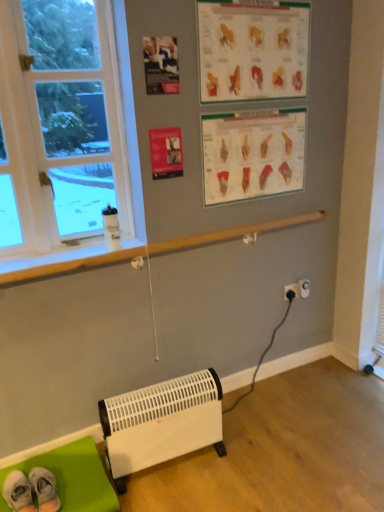
The width and height of the screenshot is (384, 512). What do you see at coordinates (18, 492) in the screenshot? I see `white fabric socks at lower left` at bounding box center [18, 492].

Where is `matte plastic poster at upper center, which is counted as the second writing, starting from the top`? Image resolution: width=384 pixels, height=512 pixels. matte plastic poster at upper center, which is counted as the second writing, starting from the top is located at coordinates (252, 154).

Describe the element at coordinates (252, 154) in the screenshot. I see `matte plastic poster at upper center, which is counted as the second writing, starting from the top` at that location.

Measure the distance between point (303, 295) and camera.

Point (303, 295) is 2.43 meters from camera.

Image resolution: width=384 pixels, height=512 pixels. What do you see at coordinates (304, 288) in the screenshot?
I see `white plastic electric outlet at lower right, the second electric outlet positioned from the left` at bounding box center [304, 288].

In order to click on green fabric mat at lower left in this screenshot , I will do `click(73, 477)`.

Does black plastic electric outlet at lower right, the second electric outlet viewed from the right, have a lesser width compared to green fabric mat at lower left?

Indeed, black plastic electric outlet at lower right, the second electric outlet viewed from the right, has a lesser width compared to green fabric mat at lower left.

This screenshot has width=384, height=512. Find the location of `furniture on the left of black plastic electric outlet at lower right, the second electric outlet viewed from the right`. furniture on the left of black plastic electric outlet at lower right, the second electric outlet viewed from the right is located at coordinates (73, 477).

Based on the photo, which of these two, black plastic electric outlet at lower right, placed as the first electric outlet when sorted from left to right, or green fabric mat at lower left, stands shorter?

black plastic electric outlet at lower right, placed as the first electric outlet when sorted from left to right.

Is white plastic window at left oriented towards matte plastic poster at upper center, marked as the second writing in a bottom-to-top arrangement?

No.

Is white plastic window at left smaller than matte plastic poster at upper center, marked as the second writing in a bottom-to-top arrangement?

Actually, white plastic window at left might be larger than matte plastic poster at upper center, marked as the second writing in a bottom-to-top arrangement.

Is point (72, 72) closer to viewer compared to point (226, 77)?

Yes, it is.

Are white plastic electric outlet at lower right, the second electric outlet positioned from the left, and white plastic window at left far apart?

white plastic electric outlet at lower right, the second electric outlet positioned from the left, is positioned a significant distance from white plastic window at left.

From a real-world perspective, is white plastic electric outlet at lower right, the second electric outlet positioned from the left, physically above white plastic window at left?

No, from a real-world perspective, white plastic electric outlet at lower right, the second electric outlet positioned from the left, is not on top of white plastic window at left.

Consider the image. From the image's perspective, between white plastic electric outlet at lower right, the second electric outlet positioned from the left, and white plastic window at left, who is located below?

white plastic electric outlet at lower right, the second electric outlet positioned from the left.

Looking at the image, does black plastic electric outlet at lower right, placed as the first electric outlet when sorted from left to right, seem bigger or smaller compared to matte plastic poster at upper center, which is counted as the 1th writing, starting from the bottom?

In the image, black plastic electric outlet at lower right, placed as the first electric outlet when sorted from left to right, appears to be smaller than matte plastic poster at upper center, which is counted as the 1th writing, starting from the bottom.

Is black plastic electric outlet at lower right, the second electric outlet viewed from the right, oriented away from matte plastic poster at upper center, which is counted as the 1th writing, starting from the bottom?

No, black plastic electric outlet at lower right, the second electric outlet viewed from the right, is not facing the opposite direction of matte plastic poster at upper center, which is counted as the 1th writing, starting from the bottom.

Which is more to the right, black plastic electric outlet at lower right, placed as the first electric outlet when sorted from left to right, or matte plastic poster at upper center, which is counted as the second writing, starting from the top?

black plastic electric outlet at lower right, placed as the first electric outlet when sorted from left to right.

The height and width of the screenshot is (512, 384). I want to click on the 2nd writing to the right when counting from the matte paper poster at upper center, so click(x=252, y=154).

Can you tell me how much matte paper poster at upper center and matte plastic poster at upper center, which is counted as the 1th writing, starting from the bottom, differ in facing direction?

The angular difference between matte paper poster at upper center and matte plastic poster at upper center, which is counted as the 1th writing, starting from the bottom, is 1.72 degrees.

Could you tell me if matte paper poster at upper center is facing matte plastic poster at upper center, which is counted as the second writing, starting from the top?

No, matte paper poster at upper center does not turn towards matte plastic poster at upper center, which is counted as the second writing, starting from the top.

Is matte paper poster at upper center spatially inside matte plastic poster at upper center, which is counted as the 1th writing, starting from the bottom, or outside of it?

The correct answer is: outside.

From the picture: From the image's perspective, between green fabric mat at lower left and matte plastic poster at upper center, which is counted as the 1th writing, starting from the bottom, which one is located above?

matte plastic poster at upper center, which is counted as the 1th writing, starting from the bottom.

How many degrees apart are the facing directions of green fabric mat at lower left and matte plastic poster at upper center, which is counted as the 1th writing, starting from the bottom?

They differ by 0.168 degrees in their facing directions.

Which is more to the left, green fabric mat at lower left or matte plastic poster at upper center, which is counted as the second writing, starting from the top?

green fabric mat at lower left.

From their relative heights in the image, would you say green fabric mat at lower left is taller or shorter than matte plastic poster at upper center, which is counted as the 1th writing, starting from the bottom?

green fabric mat at lower left is shorter than matte plastic poster at upper center, which is counted as the 1th writing, starting from the bottom.

Looking at this image, which is less distant, (x=173, y=93) or (x=297, y=293)?

The point (x=173, y=93) is more forward.

From a real-world perspective, is matte paper poster at upper center on black plastic electric outlet at lower right, the second electric outlet viewed from the right?

Correct, in the physical world, matte paper poster at upper center is higher than black plastic electric outlet at lower right, the second electric outlet viewed from the right.

In terms of height, does matte paper poster at upper center look taller or shorter compared to black plastic electric outlet at lower right, the second electric outlet viewed from the right?

In the image, matte paper poster at upper center appears to be taller than black plastic electric outlet at lower right, the second electric outlet viewed from the right.

I want to click on furniture that is in front of the black plastic electric outlet at lower right, the second electric outlet viewed from the right, so click(73, 477).

At what (x,y) coordinates should I click in order to perform the action: click on writing located above the white plastic window at left (from the image's perspective). Please return your answer as a coordinate pair (x, y). Looking at the image, I should click on [x=252, y=50].

Considering their positions, is black plastic electric outlet at lower right, the second electric outlet viewed from the right, positioned closer to matte plastic poster at upper center, which is counted as the 1th writing, starting from the bottom, than matte paper poster at upper center?

matte paper poster at upper center lies closer to matte plastic poster at upper center, which is counted as the 1th writing, starting from the bottom, than the other object.

When comparing their distances from white plastic heater at lower center, does matte paper poster at upper center or matte plastic poster at upper center, marked as the second writing in a bottom-to-top arrangement, seem closer?

matte paper poster at upper center lies closer to white plastic heater at lower center than the other object.

Estimate the real-world distances between objects in this image. Which object is closer to green fabric mat at lower left, matte paper poster at upper center or white plastic heater at lower center?

The object closer to green fabric mat at lower left is white plastic heater at lower center.

Based on their spatial positions, is matte plastic poster at upper center, marked as the second writing in a bottom-to-top arrangement, or matte plastic poster at upper center, which is counted as the 1th writing, starting from the bottom, closer to green fabric mat at lower left?

matte plastic poster at upper center, which is counted as the 1th writing, starting from the bottom, is closer to green fabric mat at lower left.

Based on their spatial positions, is matte plastic poster at upper center, which is counted as the 1th writing, starting from the bottom, or white plastic electric outlet at lower right, which ranks as the 1th electric outlet in right-to-left order, further from matte paper poster at upper center?

Among the two, white plastic electric outlet at lower right, which ranks as the 1th electric outlet in right-to-left order, is located further to matte paper poster at upper center.

Based on their spatial positions, is matte paper poster at upper center or matte plastic poster at upper center, marked as the second writing in a bottom-to-top arrangement, further from matte plastic poster at upper center, which is counted as the second writing, starting from the top?

matte paper poster at upper center lies further to matte plastic poster at upper center, which is counted as the second writing, starting from the top, than the other object.

Looking at the image, which one is located further to white plastic electric outlet at lower right, which ranks as the 1th electric outlet in right-to-left order, white fabric socks at lower left or white plastic heater at lower center?

white fabric socks at lower left is further to white plastic electric outlet at lower right, which ranks as the 1th electric outlet in right-to-left order.

From the image, which object appears to be nearer to white fabric socks at lower left, white plastic electric outlet at lower right, the second electric outlet positioned from the left, or white plastic heater at lower center?

Among the two, white plastic heater at lower center is located nearer to white fabric socks at lower left.

Identify the location of writing that lies between matte paper poster at upper center and white fabric socks at lower left from top to bottom. This screenshot has width=384, height=512. (252, 154).

Identify the location of electric outlet between white plastic window at left and white plastic electric outlet at lower right, the second electric outlet positioned from the left. (292, 290).

Image resolution: width=384 pixels, height=512 pixels. I want to click on writing between matte paper poster at upper center and matte plastic poster at upper center, which is counted as the second writing, starting from the top, so click(252, 50).

The image size is (384, 512). I want to click on writing between matte plastic poster at upper center, marked as the second writing in a bottom-to-top arrangement, and white fabric socks at lower left in the up-down direction, so click(252, 154).